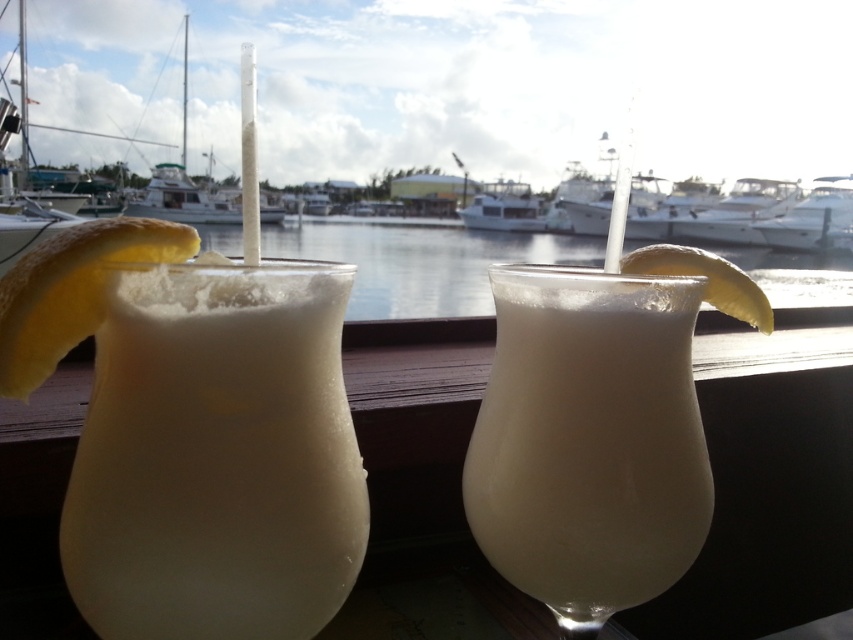
You are a bartender preparing drinks for a customer who wants a tropical cocktail with a lemon garnish. You have two glasses in front of you, one with translucent liquid at center and another with white glossy boat at right. Which glass should you serve the customer?

The customer should be served the translucent liquid at center because it is located below the white glossy boat at right, indicating it is the drink with the lemon garnish.

Based on the photo, you are a delivery robot positioned at the bottom edge of the window. You need to deliver a package to the translucent liquid at center located at point (x=421, y=262). The window is 1 meter tall. What direction should you move in to reach it?

The translucent liquid at center is located at point (x=421, y=262). Since you are at the bottom edge, you should move upward to reach it.